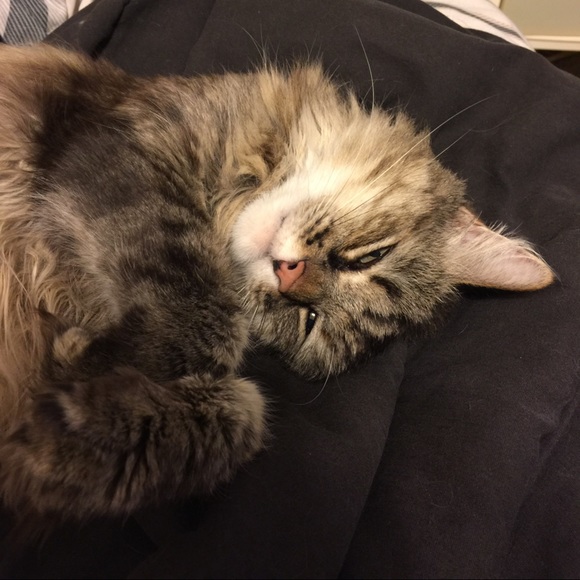
Locate an element on the screen. wall is located at coordinates (545, 24).